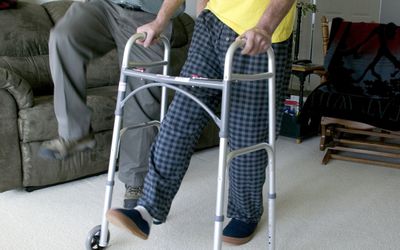
Where is `candle`? This screenshot has height=250, width=400. candle is located at coordinates (313, 18).